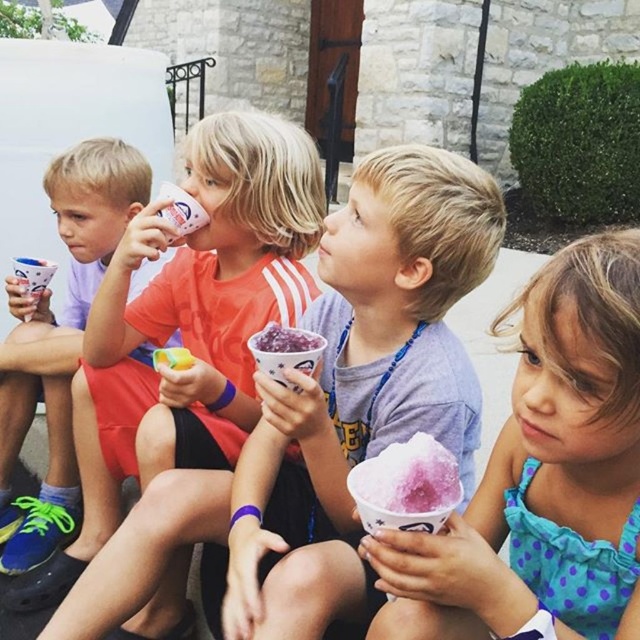
Which of these two, pink frosted snow cone at center or matte plastic cup at center, stands taller?

Standing taller between the two is matte plastic cup at center.

Which is below, pink frosted snow cone at center or matte plastic cup at center?

pink frosted snow cone at center is lower down.

Locate an element on the screen. This screenshot has width=640, height=640. pink frosted snow cone at center is located at coordinates (544, 474).

Which of these two, pink frosted snow cone at center or matte white cup at left, stands taller?

matte white cup at left is taller.

Is point (540, 380) more distant than point (97, 232)?

That is False.

The width and height of the screenshot is (640, 640). What are the coordinates of `pink frosted snow cone at center` in the screenshot? It's located at (544, 474).

Can you confirm if matte plastic cup at center is shorter than matte white cup at left?

In fact, matte plastic cup at center may be taller than matte white cup at left.

Is matte plastic cup at center taller than matte white cup at left?

Yes.

What do you see at coordinates (189, 323) in the screenshot? I see `matte plastic cup at center` at bounding box center [189, 323].

Find the location of `matte plastic cup at center`. matte plastic cup at center is located at coordinates (189, 323).